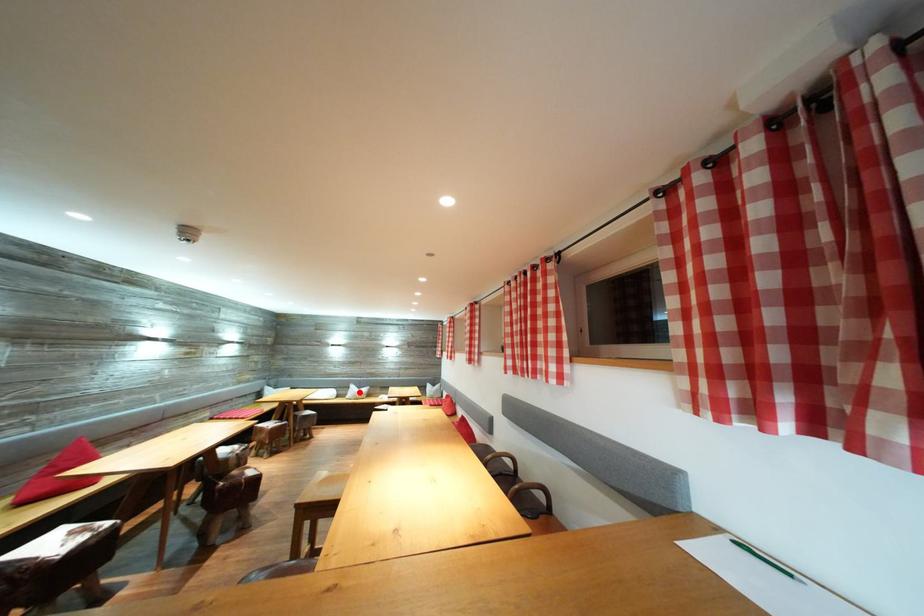
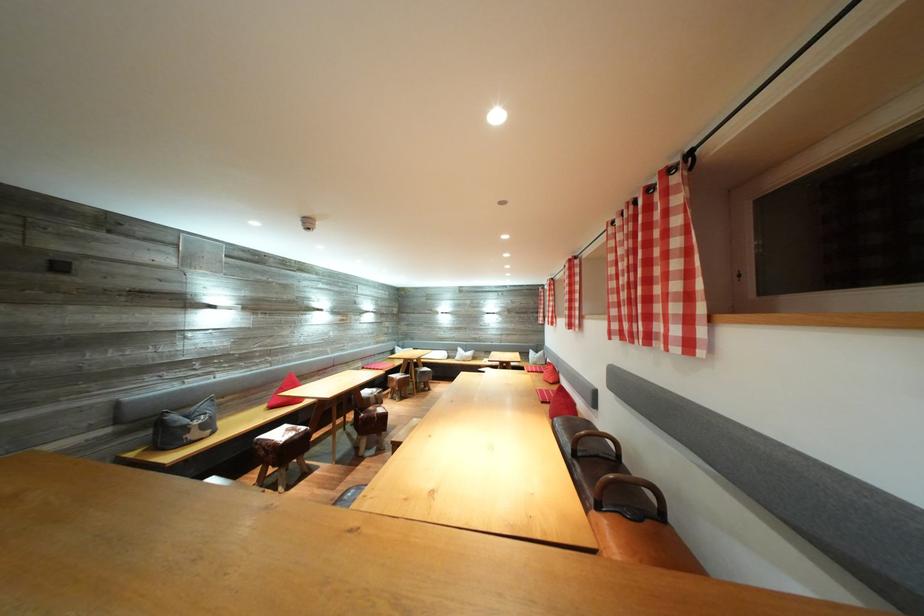
Where in the second image is the point corresponding to the highlighted location from the first image?

(467, 355)